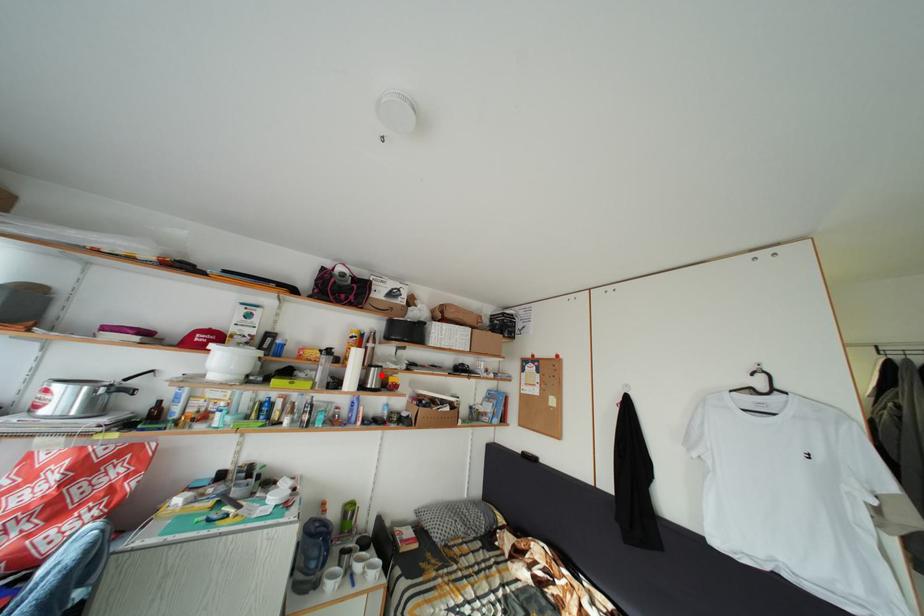
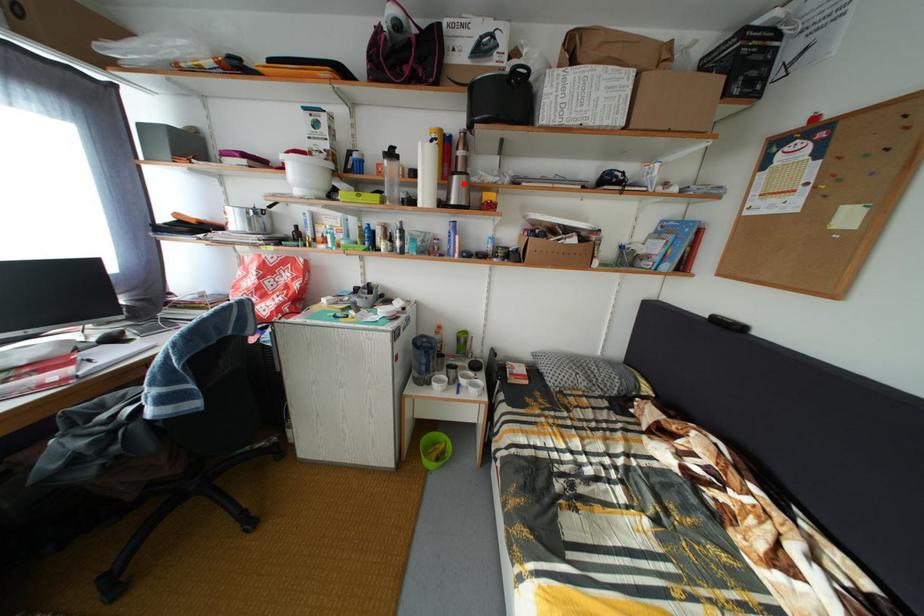
I am providing you with two images of the same scene from different viewpoints. A red point is marked on the first image and another point is marked on the second image. Are the points marked in image1 and image2 representing the same 3D position?

Yes